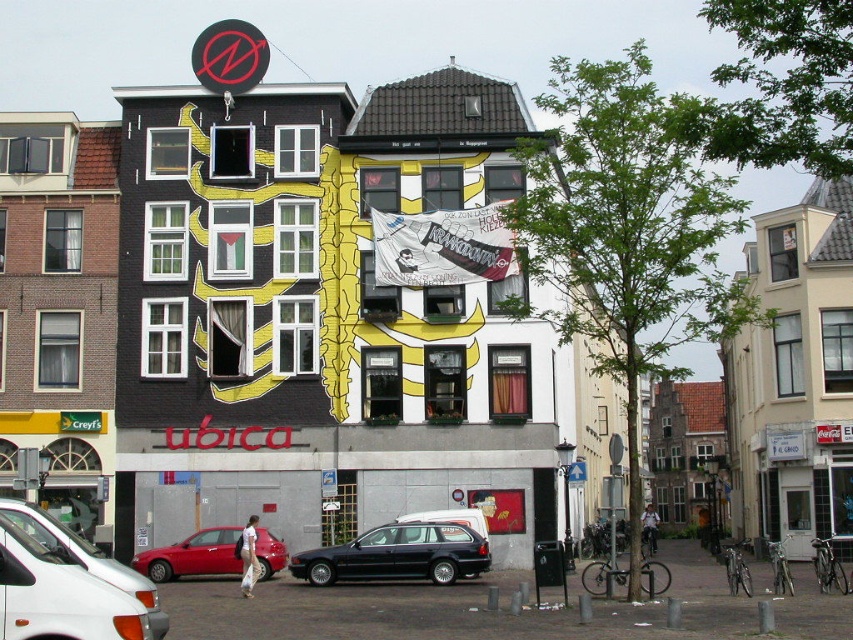
Looking at this image, is metallic dark blue wagon at center in front of shiny red sedan at lower left?

Yes, metallic dark blue wagon at center is in front of shiny red sedan at lower left.

Can you confirm if metallic dark blue wagon at center is positioned to the right of shiny red sedan at lower left?

Correct, you'll find metallic dark blue wagon at center to the right of shiny red sedan at lower left.

Describe the element at coordinates (397, 554) in the screenshot. I see `metallic dark blue wagon at center` at that location.

Find the location of a particular element. This screenshot has width=853, height=640. metallic dark blue wagon at center is located at coordinates (397, 554).

Can you confirm if white matte van at lower left is taller than shiny red sedan at lower left?

Correct, white matte van at lower left is much taller as shiny red sedan at lower left.

In the scene shown: Does white matte van at lower left lie behind shiny red sedan at lower left?

No, it is in front of shiny red sedan at lower left.

Is point (138, 611) less distant than point (163, 570)?

That is True.

Find the location of a particular element. The width and height of the screenshot is (853, 640). white matte van at lower left is located at coordinates (61, 595).

Does white matte van at lower left have a greater width compared to metallic dark blue wagon at center?

In fact, white matte van at lower left might be narrower than metallic dark blue wagon at center.

Can you confirm if white matte van at lower left is positioned to the right of metallic dark blue wagon at center?

Incorrect, white matte van at lower left is not on the right side of metallic dark blue wagon at center.

Is point (19, 566) more distant than point (358, 572)?

No, (19, 566) is closer to viewer.

Identify the location of white matte van at lower left. (61, 595).